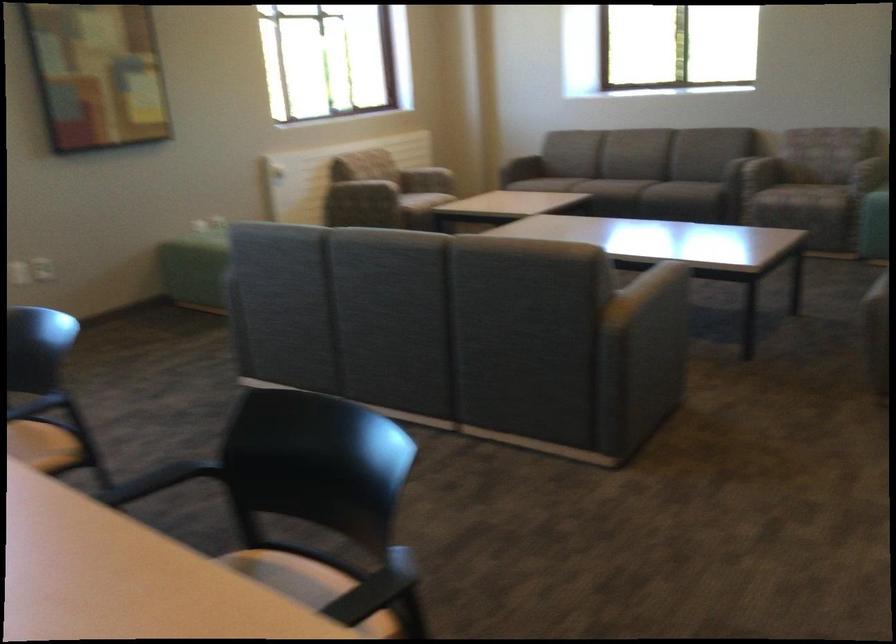
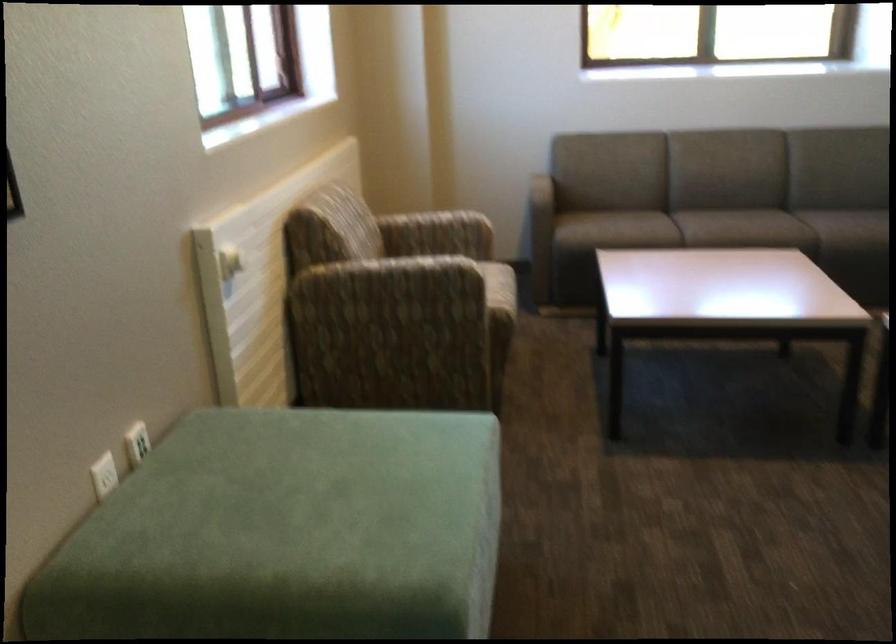
Find the pixel in the second image that matches [613,178] in the first image.

(780, 229)